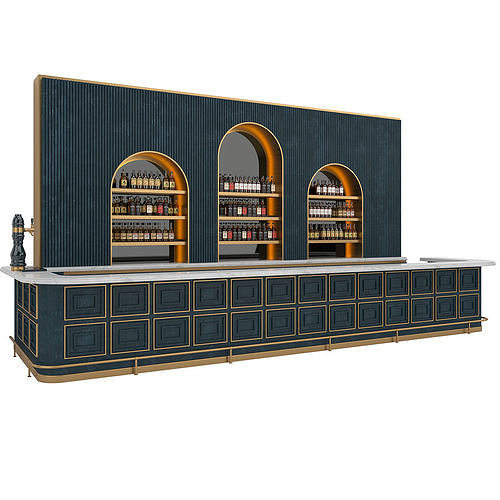
I want to click on 3d model of a alcohol bar, so click(x=285, y=272).